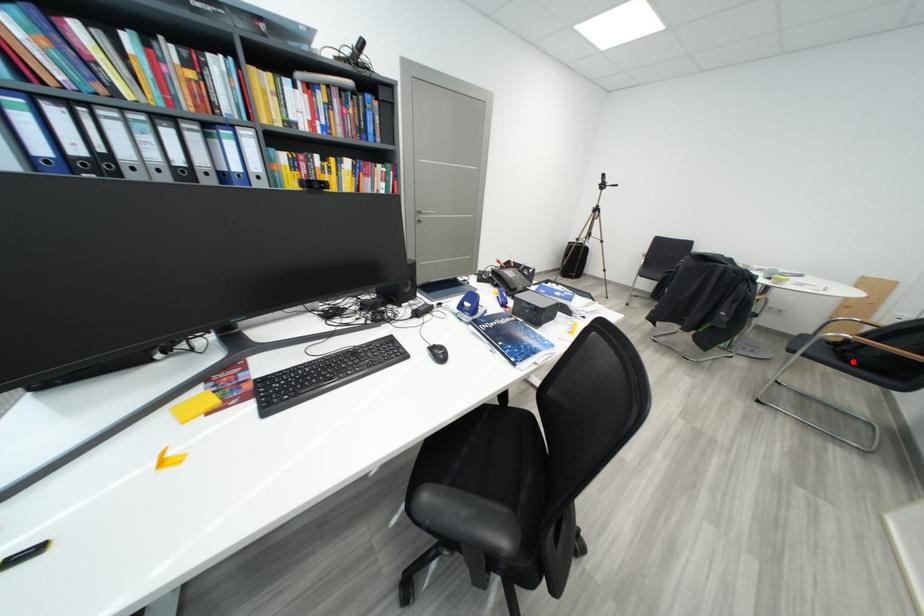
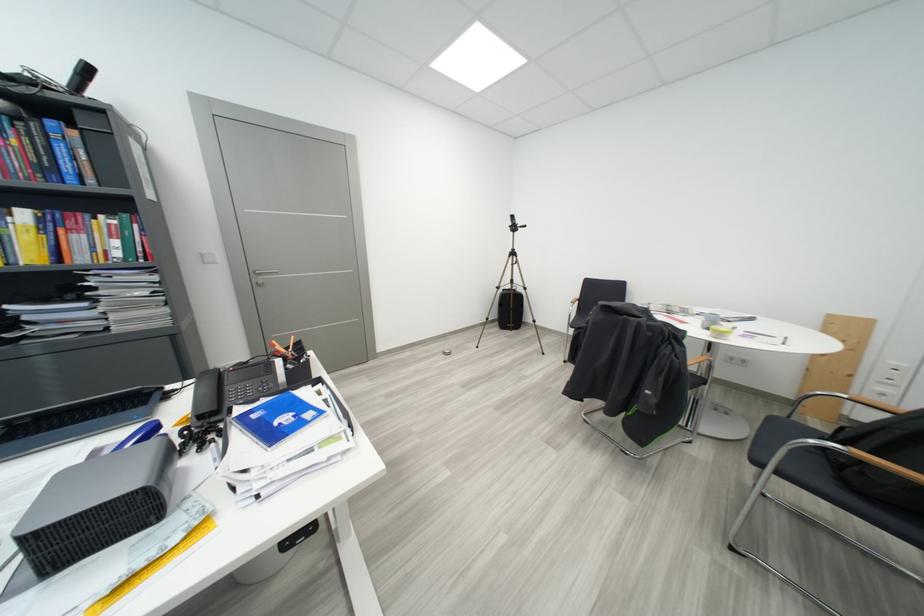
Find the pixel in the second image that matches the highlighted location in the first image.

(856, 487)